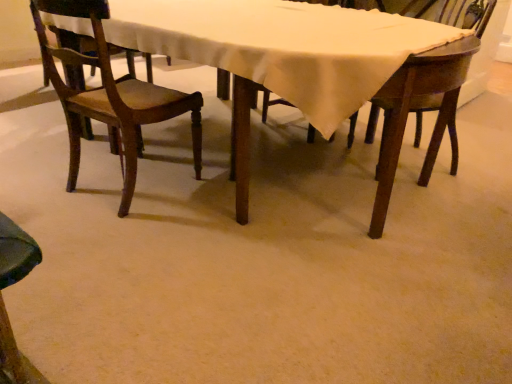
What do you see at coordinates (467, 14) in the screenshot? I see `wooden chair at upper right, placed as the first chair when sorted from right to left` at bounding box center [467, 14].

Measure the distance between wooden table at center and camera.

The distance of wooden table at center from camera is 4.28 feet.

Describe the element at coordinates (412, 104) in the screenshot. The width and height of the screenshot is (512, 384). I see `wooden table at center` at that location.

The image size is (512, 384). In order to click on wooden chair at left, the 2th chair from the right in this screenshot , I will do `click(111, 96)`.

Find the location of a particular element. This screenshot has height=384, width=512. wooden chair at upper right, placed as the first chair when sorted from right to left is located at coordinates (467, 14).

Is wooden table at center smaller than wooden chair at left, which is counted as the first chair, starting from the left?

No, wooden table at center is not smaller than wooden chair at left, which is counted as the first chair, starting from the left.

In the scene shown: Does wooden table at center turn towards wooden chair at left, which is counted as the first chair, starting from the left?

Yes, wooden table at center is facing wooden chair at left, which is counted as the first chair, starting from the left.

Is wooden table at center far from wooden chair at left, which is counted as the first chair, starting from the left?

Actually, wooden table at center and wooden chair at left, which is counted as the first chair, starting from the left, are a little close together.

Considering their positions, is wooden table at center located in front of or behind wooden chair at left, which is counted as the first chair, starting from the left?

In the image, wooden table at center appears in front of wooden chair at left, which is counted as the first chair, starting from the left.

Considering the sizes of objects wooden chair at left, which is counted as the first chair, starting from the left, and wooden chair at upper right, positioned as the 2th chair in left-to-right order, in the image provided, who is smaller, wooden chair at left, which is counted as the first chair, starting from the left, or wooden chair at upper right, positioned as the 2th chair in left-to-right order,?

With smaller size is wooden chair at upper right, positioned as the 2th chair in left-to-right order.

Identify the location of chair behind the wooden chair at left, which is counted as the first chair, starting from the left. The image size is (512, 384). (467, 14).

From the picture: From the image's perspective, is wooden chair at left, the 2th chair from the right, located beneath wooden chair at upper right, positioned as the 2th chair in left-to-right order?

Yes, from the image's perspective, wooden chair at left, the 2th chair from the right, is beneath wooden chair at upper right, positioned as the 2th chair in left-to-right order.

Is wooden chair at upper right, placed as the first chair when sorted from right to left, at the back of wooden chair at left, the 2th chair from the right?

No, wooden chair at left, the 2th chair from the right,'s orientation is not away from wooden chair at upper right, placed as the first chair when sorted from right to left.

Is wooden chair at left, which is counted as the first chair, starting from the left, completely or partially outside of wooden table at center?

No, wooden chair at left, which is counted as the first chair, starting from the left, is inside wooden table at center's boundary.

From a real-world perspective, is wooden chair at left, the 2th chair from the right, above or below wooden table at center?

From a real-world perspective, wooden chair at left, the 2th chair from the right, is physically above wooden table at center.

Is point (118, 137) positioned after point (436, 57)?

Yes, point (118, 137) is behind point (436, 57).

From a real-world perspective, is wooden chair at upper right, placed as the first chair when sorted from right to left, positioned above or below wooden table at center?

wooden chair at upper right, placed as the first chair when sorted from right to left, is situated higher than wooden table at center in the real world.

Is wooden table at center at the back of wooden chair at upper right, placed as the first chair when sorted from right to left?

Yes, wooden chair at upper right, placed as the first chair when sorted from right to left, is positioned with its back facing wooden table at center.

From the picture: Is there a large distance between wooden chair at upper right, placed as the first chair when sorted from right to left, and wooden table at center?

wooden chair at upper right, placed as the first chair when sorted from right to left, is actually quite close to wooden table at center.

Find the location of a particular element. Image resolution: width=512 pixels, height=384 pixels. kitchen & dining room table on the left of the wooden chair at upper right, positioned as the 2th chair in left-to-right order is located at coordinates (412, 104).

Is wooden chair at upper right, placed as the first chair when sorted from right to left, facing towards wooden chair at left, the 2th chair from the right?

Yes, wooden chair at upper right, placed as the first chair when sorted from right to left, is facing wooden chair at left, the 2th chair from the right.

In the image, is wooden chair at upper right, placed as the first chair when sorted from right to left, on the left side or the right side of wooden chair at left, the 2th chair from the right?

A: Based on their positions, wooden chair at upper right, placed as the first chair when sorted from right to left, is located to the right of wooden chair at left, the 2th chair from the right.

Looking at this image, how different are the orientations of wooden chair at upper right, positioned as the 2th chair in left-to-right order, and wooden chair at left, the 2th chair from the right, in degrees?

They differ by 135 degrees in their facing directions.

Is wooden chair at upper right, positioned as the 2th chair in left-to-right order, wider than wooden chair at left, the 2th chair from the right?

In fact, wooden chair at upper right, positioned as the 2th chair in left-to-right order, might be narrower than wooden chair at left, the 2th chair from the right.

Where is `kitchen & dining room table on the left side of wooden chair at upper right, placed as the first chair when sorted from right to left`? The width and height of the screenshot is (512, 384). kitchen & dining room table on the left side of wooden chair at upper right, placed as the first chair when sorted from right to left is located at coordinates (412, 104).

Which object is positioned more to the left, wooden table at center or wooden chair at upper right, placed as the first chair when sorted from right to left?

wooden table at center.

From a real-world perspective, relative to wooden chair at upper right, placed as the first chair when sorted from right to left, is wooden table at center vertically above or below?

From a real-world perspective, wooden table at center is physically below wooden chair at upper right, placed as the first chair when sorted from right to left.

What's the angular difference between wooden table at center and wooden chair at upper right, placed as the first chair when sorted from right to left,'s facing directions?

wooden table at center and wooden chair at upper right, placed as the first chair when sorted from right to left, are facing 37.8 degrees away from each other.

Where is `kitchen & dining room table above the wooden chair at left, the 2th chair from the right (from the image's perspective)`? The width and height of the screenshot is (512, 384). kitchen & dining room table above the wooden chair at left, the 2th chair from the right (from the image's perspective) is located at coordinates click(x=412, y=104).

I want to click on chair to the left of wooden chair at upper right, placed as the first chair when sorted from right to left, so click(x=111, y=96).

Which object lies nearer to the anchor point wooden chair at left, which is counted as the first chair, starting from the left, wooden chair at upper right, positioned as the 2th chair in left-to-right order, or wooden table at center?

wooden table at center is closer to wooden chair at left, which is counted as the first chair, starting from the left.

Based on their spatial positions, is wooden chair at left, the 2th chair from the right, or wooden table at center closer to wooden chair at upper right, placed as the first chair when sorted from right to left?

wooden table at center.

Based on their spatial positions, is wooden chair at upper right, positioned as the 2th chair in left-to-right order, or wooden chair at left, which is counted as the first chair, starting from the left, further from wooden table at center?

wooden chair at upper right, positioned as the 2th chair in left-to-right order, lies further to wooden table at center than the other object.

Looking at the image, which one is located closer to wooden table at center, wooden chair at left, the 2th chair from the right, or wooden chair at upper right, placed as the first chair when sorted from right to left?

wooden chair at left, the 2th chair from the right.

Which object lies further to the anchor point wooden chair at left, which is counted as the first chair, starting from the left, wooden table at center or wooden chair at upper right, placed as the first chair when sorted from right to left?

Among the two, wooden chair at upper right, placed as the first chair when sorted from right to left, is located further to wooden chair at left, which is counted as the first chair, starting from the left.

Considering their positions, is wooden table at center positioned closer to wooden chair at upper right, positioned as the 2th chair in left-to-right order, than wooden chair at left, the 2th chair from the right?

The object closer to wooden chair at upper right, positioned as the 2th chair in left-to-right order, is wooden table at center.

You are a GUI agent. You are given a task and a screenshot of the screen. Output one action in this format:
    pyautogui.click(x=<x>, y=<y>)
    Task: Click on the kitchen & dining room table situated between wooden chair at left, the 2th chair from the right, and wooden chair at upper right, positioned as the 2th chair in left-to-right order, from left to right
    
    Given the screenshot: What is the action you would take?
    pyautogui.click(x=412, y=104)